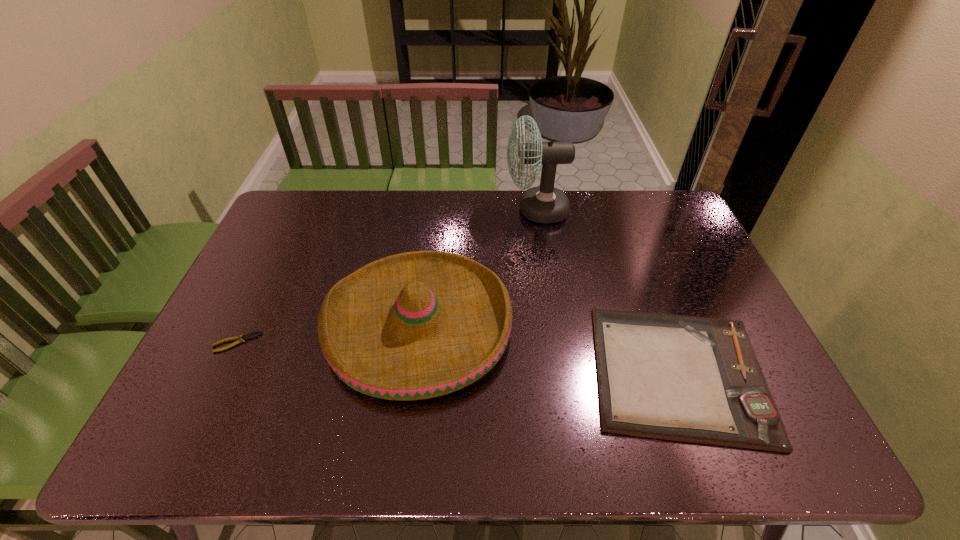
At what (x,y) coordinates should I click in order to perform the action: click on vacant region located 0.270m on the left of the second object from left to right. Please return your answer as a coordinate pair (x, y). Image resolution: width=960 pixels, height=540 pixels. Looking at the image, I should click on (228, 325).

Locate an element on the screen. The height and width of the screenshot is (540, 960). vacant space located on the back of the second shortest object is located at coordinates (635, 255).

At what (x,y) coordinates should I click in order to perform the action: click on free spot located on the right of the leftmost object. Please return your answer as a coordinate pair (x, y). This screenshot has height=540, width=960. Looking at the image, I should click on (289, 342).

Where is `object that is at the far edge`? This screenshot has width=960, height=540. object that is at the far edge is located at coordinates (546, 204).

Find the location of `object at the near edge`. object at the near edge is located at coordinates (694, 379).

Locate an element on the screen. The height and width of the screenshot is (540, 960). object at the left edge is located at coordinates (241, 338).

This screenshot has height=540, width=960. I want to click on object present at the right edge, so [x=694, y=379].

In order to click on object present at the near right corner in this screenshot , I will do `click(694, 379)`.

What are the coordinates of `vacant space at the far edge` in the screenshot? It's located at (482, 217).

Find the location of `vacant region at the near edge of the desktop`. vacant region at the near edge of the desktop is located at coordinates (377, 440).